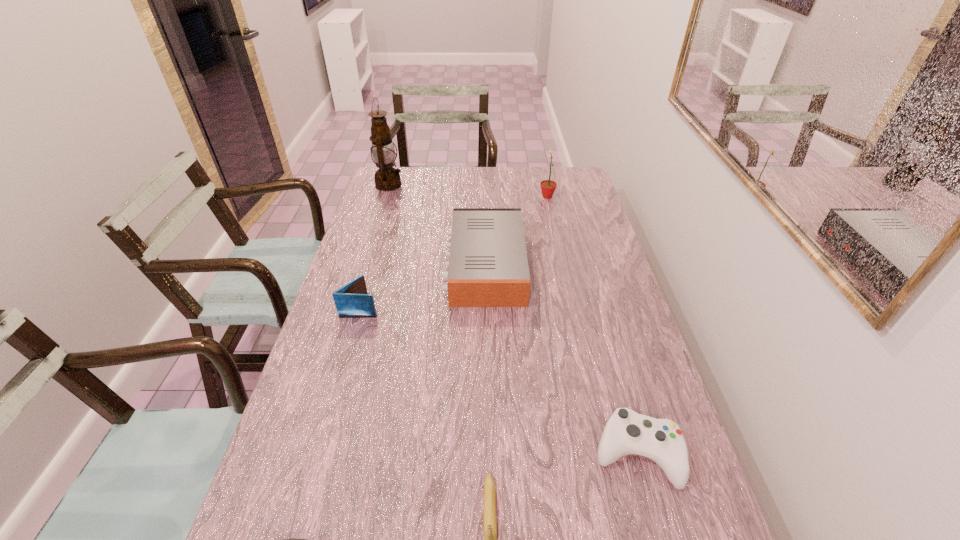
Locate an element on the screen. The width and height of the screenshot is (960, 540). object situated at the far left corner is located at coordinates [387, 178].

Image resolution: width=960 pixels, height=540 pixels. I want to click on object positioned at the far right corner, so click(x=548, y=187).

Image resolution: width=960 pixels, height=540 pixels. In order to click on vacant space at the far edge in this screenshot , I will do coord(450,169).

Locate an element on the screen. The image size is (960, 540). vacant space at the left edge is located at coordinates (309, 400).

The image size is (960, 540). Find the location of `free space at the right edge of the desktop`. free space at the right edge of the desktop is located at coordinates (568, 221).

The width and height of the screenshot is (960, 540). Identify the location of blank space at the far right corner of the desktop. (584, 190).

I want to click on free spot between the tallest object and the farther control, so click(513, 319).

You are a GUI agent. You are given a task and a screenshot of the screen. Output one action in this format:
    pyautogui.click(x=<x>, y=<y>)
    Task: Click on the free spot between the oil lamp and the wallet
    
    Given the screenshot: What is the action you would take?
    pyautogui.click(x=375, y=246)

At what (x,y) coordinates should I click in order to perform the action: click on vacant space that is in between the radio receiver and the wallet. Please return your answer as a coordinate pair (x, y). This screenshot has height=540, width=960. Looking at the image, I should click on (422, 286).

This screenshot has height=540, width=960. I want to click on free space between the oil lamp and the wallet, so click(375, 246).